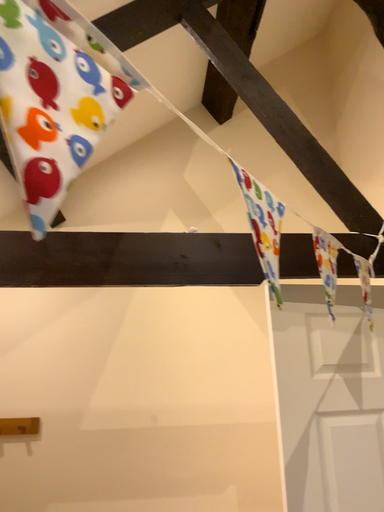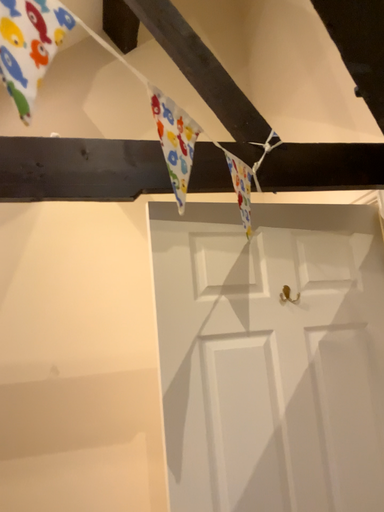
Question: How did the camera likely rotate when shooting the video?

Choices:
 (A) rotated left
 (B) rotated right

Answer: (B)